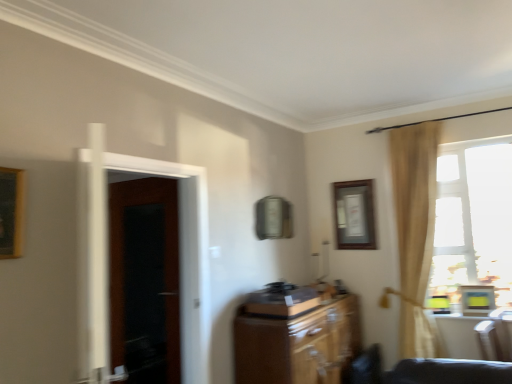
Question: Is wooden record player at center positioned far away from wooden picture frame at upper center?

Choices:
 (A) no
 (B) yes

Answer: (B)

Question: From the image's perspective, would you say wooden record player at center is positioned over wooden picture frame at upper center?

Choices:
 (A) yes
 (B) no

Answer: (B)

Question: Is wooden record player at center bigger than wooden picture frame at upper center?

Choices:
 (A) no
 (B) yes

Answer: (B)

Question: Is wooden record player at center wider than wooden picture frame at upper center?

Choices:
 (A) yes
 (B) no

Answer: (A)

Question: From a real-world perspective, is wooden record player at center on top of wooden picture frame at upper center?

Choices:
 (A) yes
 (B) no

Answer: (B)

Question: From a real-world perspective, is wooden cabinet at center physically located above or below transparent glass window at right?

Choices:
 (A) below
 (B) above

Answer: (A)

Question: From the image's perspective, is wooden cabinet at center located above or below transparent glass window at right?

Choices:
 (A) below
 (B) above

Answer: (A)

Question: Is wooden cabinet at center in front of or behind transparent glass window at right in the image?

Choices:
 (A) front
 (B) behind

Answer: (A)

Question: Does point (271, 364) appear closer or farther from the camera than point (457, 226)?

Choices:
 (A) closer
 (B) farther

Answer: (A)

Question: Choose the correct answer: Is dark wood door at left inside transparent glass window at right or outside it?

Choices:
 (A) inside
 (B) outside

Answer: (B)

Question: Is point (145, 208) closer or farther from the camera than point (487, 145)?

Choices:
 (A) closer
 (B) farther

Answer: (B)

Question: In terms of width, does dark wood door at left look wider or thinner when compared to transparent glass window at right?

Choices:
 (A) thin
 (B) wide

Answer: (A)

Question: From the image's perspective, is dark wood door at left located above or below transparent glass window at right?

Choices:
 (A) above
 (B) below

Answer: (B)

Question: Looking at the image, does dark wood door at left seem bigger or smaller compared to wooden cabinet at center?

Choices:
 (A) small
 (B) big

Answer: (A)

Question: Considering their positions, is dark wood door at left located in front of or behind wooden cabinet at center?

Choices:
 (A) behind
 (B) front

Answer: (A)